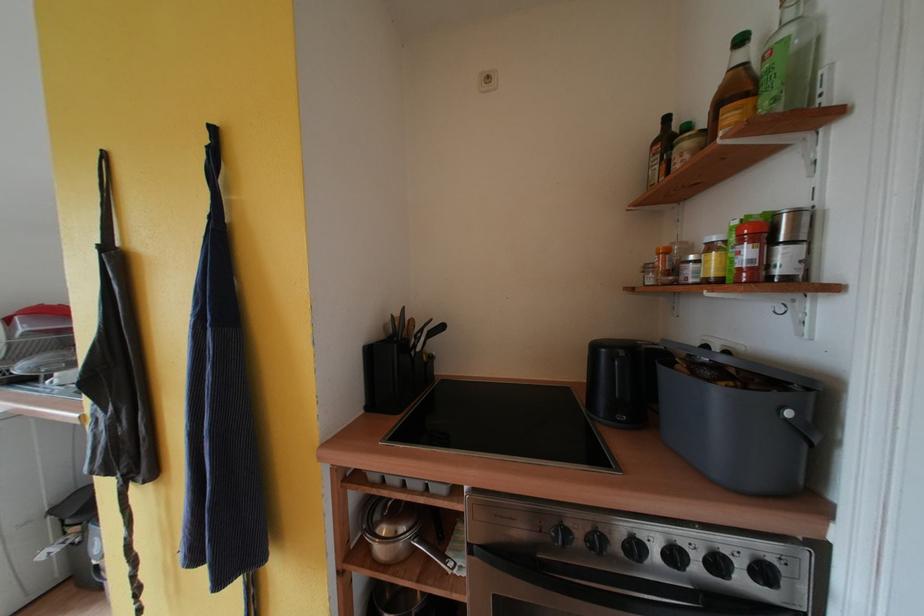
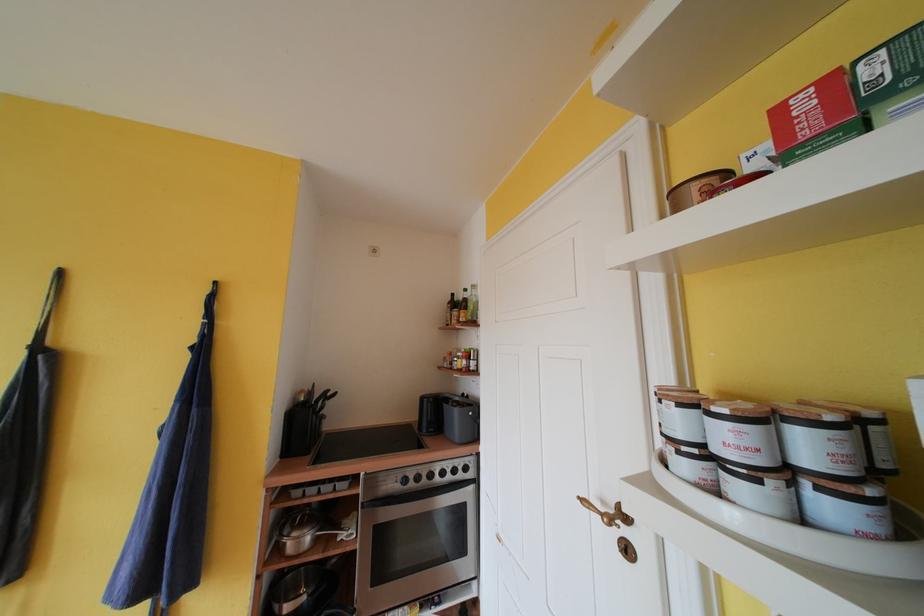
Find the pixel in the second image that matches [641,551] in the first image.

(436, 479)